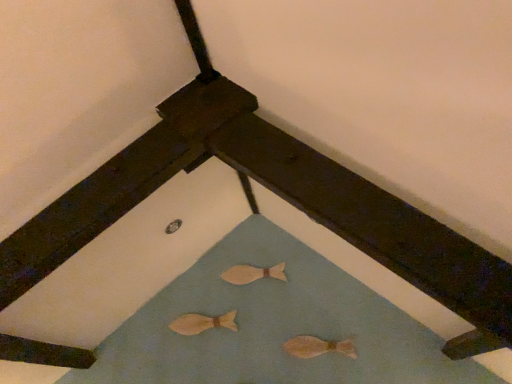
Question: Is light brown wooden fish at lower center, which ranks as the first animal in right-to-left order, at the right side of wooden fish at center, acting as the third animal starting from the bottom?

Choices:
 (A) no
 (B) yes

Answer: (B)

Question: Considering the relative sizes of light brown wooden fish at lower center, which ranks as the first animal in right-to-left order, and wooden fish at center, the 2th animal in the right-to-left sequence, in the image provided, is light brown wooden fish at lower center, which ranks as the first animal in right-to-left order, smaller than wooden fish at center, the 2th animal in the right-to-left sequence,?

Choices:
 (A) yes
 (B) no

Answer: (B)

Question: Could you tell me if light brown wooden fish at lower center, which is the 3th animal in left-to-right order, is turned towards wooden fish at center, the 2th animal in the right-to-left sequence?

Choices:
 (A) yes
 (B) no

Answer: (B)

Question: From a real-world perspective, does light brown wooden fish at lower center, which is the 3th animal in left-to-right order, stand above wooden fish at center, acting as the third animal starting from the front?

Choices:
 (A) yes
 (B) no

Answer: (B)

Question: From the image's perspective, would you say light brown wooden fish at lower center, which is the 3th animal in left-to-right order, is positioned over wooden fish at center, acting as the third animal starting from the bottom?

Choices:
 (A) no
 (B) yes

Answer: (A)

Question: From the image's perspective, is light brown wooden fish at lower center, which appears as the third animal when viewed from the back, under wooden fish at center, acting as the third animal starting from the front?

Choices:
 (A) no
 (B) yes

Answer: (B)

Question: From the image's perspective, does wooden fish at center, which is counted as the 2th animal, starting from the front, appear higher than light brown wooden fish at lower center, placed as the third animal when sorted from top to bottom?

Choices:
 (A) yes
 (B) no

Answer: (A)

Question: Is wooden fish at center, which is counted as the 2th animal, starting from the front, aimed at light brown wooden fish at lower center, which appears as the third animal when viewed from the back?

Choices:
 (A) yes
 (B) no

Answer: (B)

Question: Considering the relative sizes of wooden fish at center, the 2th animal positioned from the bottom, and light brown wooden fish at lower center, which appears as the first animal when ordered from the bottom, in the image provided, is wooden fish at center, the 2th animal positioned from the bottom, wider than light brown wooden fish at lower center, which appears as the first animal when ordered from the bottom,?

Choices:
 (A) yes
 (B) no

Answer: (A)

Question: Considering the relative positions of wooden fish at center, the second animal positioned from the back, and light brown wooden fish at lower center, placed as the third animal when sorted from top to bottom, in the image provided, is wooden fish at center, the second animal positioned from the back, to the left of light brown wooden fish at lower center, placed as the third animal when sorted from top to bottom, from the viewer's perspective?

Choices:
 (A) yes
 (B) no

Answer: (A)

Question: From a real-world perspective, is wooden fish at center, arranged as the second animal when viewed from the top, physically above light brown wooden fish at lower center, which is counted as the 1th animal, starting from the front?

Choices:
 (A) yes
 (B) no

Answer: (A)

Question: Is wooden fish at center, the 2th animal positioned from the bottom, not inside light brown wooden fish at lower center, placed as the third animal when sorted from top to bottom?

Choices:
 (A) yes
 (B) no

Answer: (A)

Question: Are wooden fish at center, the 1th animal when ordered from left to right, and wooden fish at center, the 1th animal from the back, far apart?

Choices:
 (A) yes
 (B) no

Answer: (B)